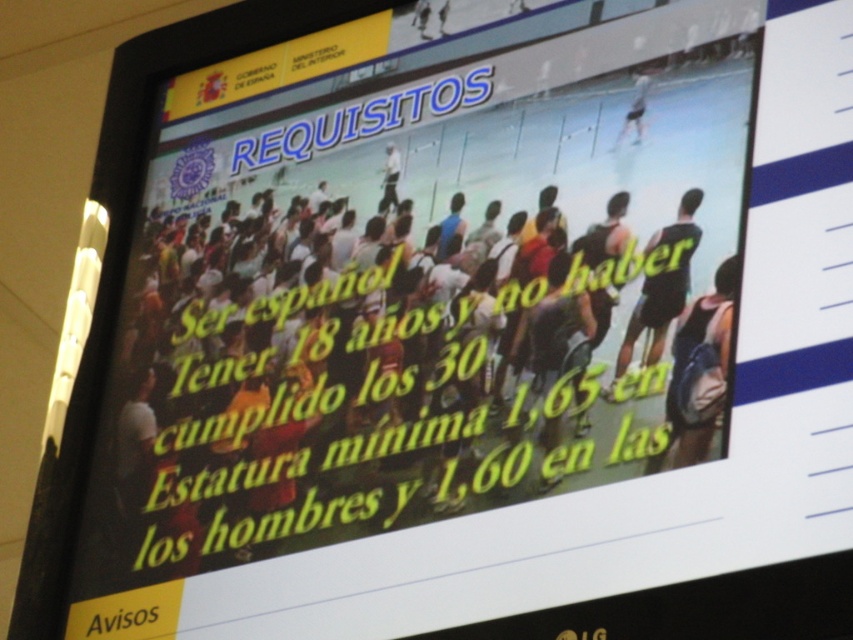
Question: Which object appears closest to the camera in this image?

Choices:
 (A) light blue fabric shorts at upper right
 (B) matte black backpack at center

Answer: (B)

Question: Does matte black backpack at center appear over light blue fabric shorts at upper right?

Choices:
 (A) yes
 (B) no

Answer: (B)

Question: Can you confirm if matte black backpack at center is positioned above dark blue athletic shorts at center?

Choices:
 (A) yes
 (B) no

Answer: (B)

Question: Which of the following is the farthest from the observer?

Choices:
 (A) (544, 461)
 (B) (660, 326)

Answer: (B)

Question: Can you confirm if matte black backpack at center is positioned below dark blue athletic shorts at center?

Choices:
 (A) yes
 (B) no

Answer: (A)

Question: Which object is positioned closest to the matte black backpack at center?

Choices:
 (A) light blue fabric shorts at upper right
 (B) dark blue athletic shorts at center

Answer: (B)